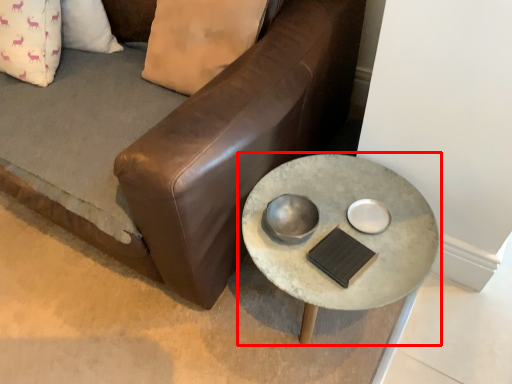
Question: From the image's perspective, where is table (annotated by the red box) located in relation to studio couch in the image?

Choices:
 (A) below
 (B) above

Answer: (A)